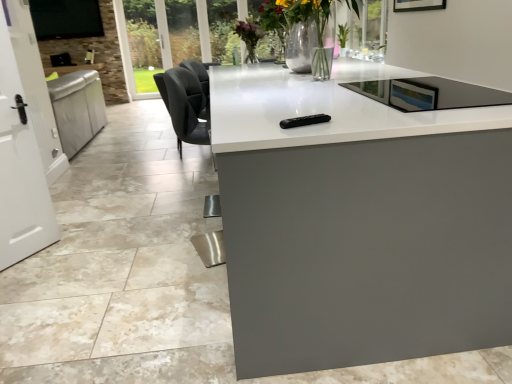
Find the location of a particular element. The height and width of the screenshot is (384, 512). free point below white glossy door at left (from a real-world perspective) is located at coordinates (31, 256).